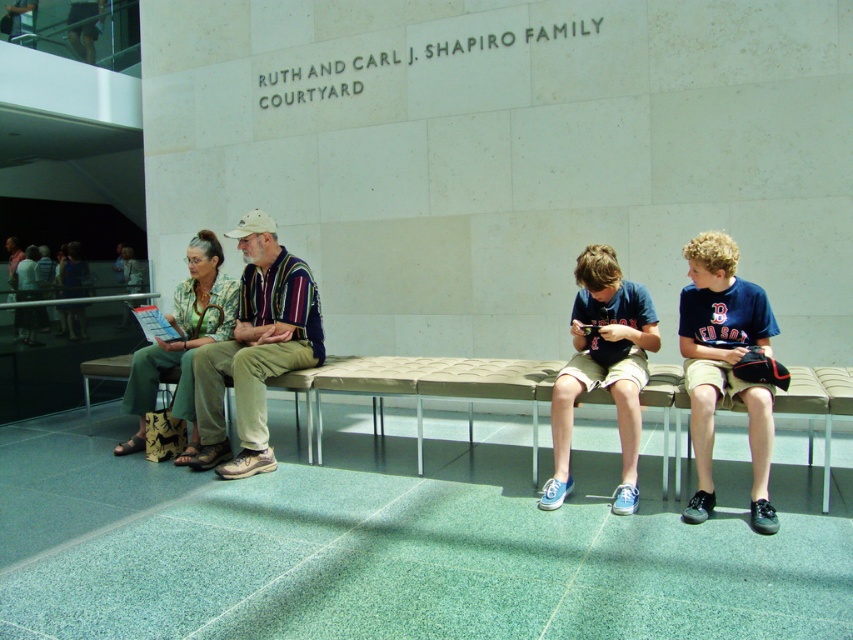
You are a person with a 12 inch wide backpack. You want to place your backpack between the beige quilted fabric bench at center and the blue canvas sneakers at center. Is there enough space for your backpack?

The beige quilted fabric bench at center is 16.37 inches from blue canvas sneakers at center. Since your backpack is 12 inches wide, there is enough space to place it between them as the distance is greater than the backpack width.

You are standing at the camera position and want to throw a ball to hit a target located at point (666,396). What is the minimum distance you need to throw the ball?

The minimum distance you need to throw the ball is 3.82 meters to reach the point (666,396).